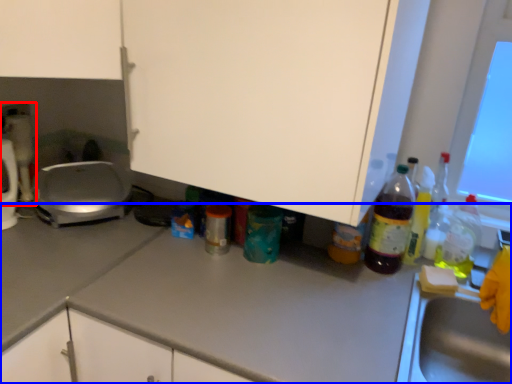
Question: Which object is closer to the camera taking this photo, appliance (highlighted by a red box) or countertop (highlighted by a blue box)?

Choices:
 (A) appliance
 (B) countertop

Answer: (B)